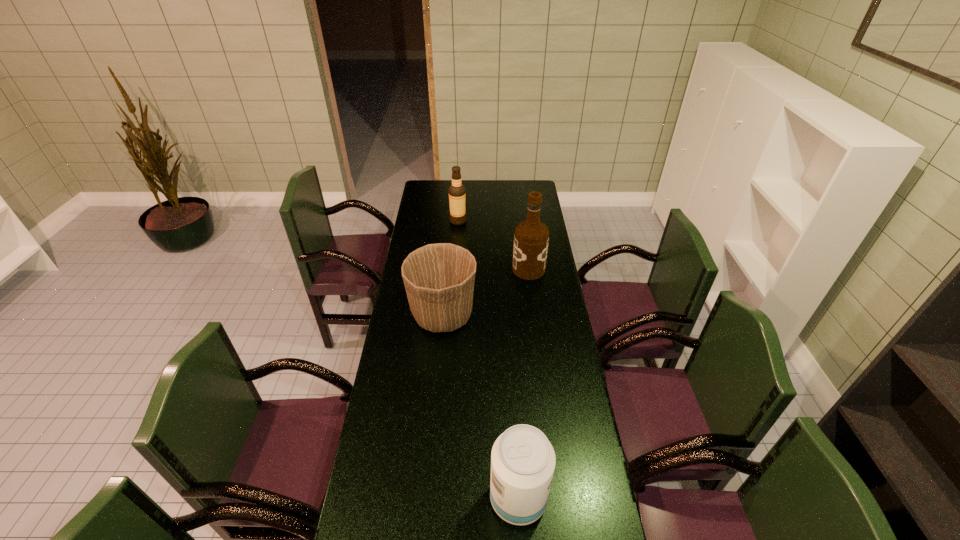
At what (x,y) coordinates should I click in order to perform the action: click on vacant region that satisfies the following two spatial constraints: 1. on the label of the third nearest object; 2. on the front side of the third farthest object. Please return your answer as a coordinate pair (x, y). Looking at the image, I should click on (535, 315).

Where is `vacant position in the image that satisfies the following two spatial constraints: 1. on the label of the nearest alcohol; 2. on the right side of the farthest alcohol`? vacant position in the image that satisfies the following two spatial constraints: 1. on the label of the nearest alcohol; 2. on the right side of the farthest alcohol is located at coordinates (440, 498).

Find the location of `vacant region that satisfies the following two spatial constraints: 1. on the back side of the nearest alcohol; 2. on the label of the farthest alcohol`. vacant region that satisfies the following two spatial constraints: 1. on the back side of the nearest alcohol; 2. on the label of the farthest alcohol is located at coordinates (501, 221).